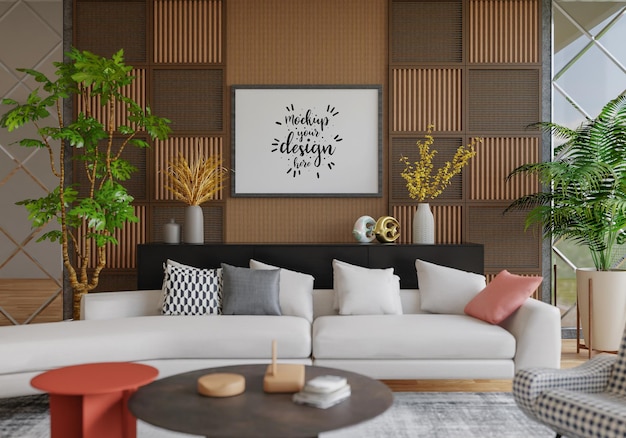
The height and width of the screenshot is (438, 626). What are the coordinates of `white couch` in the screenshot? It's located at (255, 328).